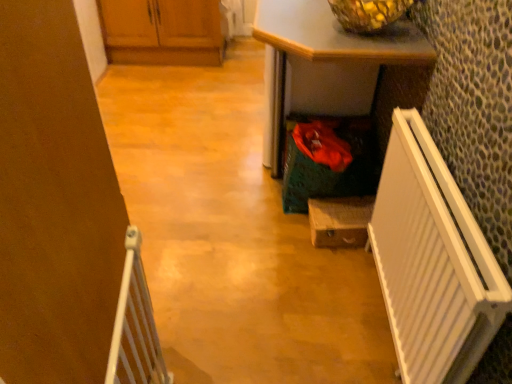
This screenshot has width=512, height=384. What are the coordinates of `vacant area that is in front of wooden cabinets at upper left, marked as the 1th cabinetry in a top-to-bottom arrangement` in the screenshot? It's located at (162, 90).